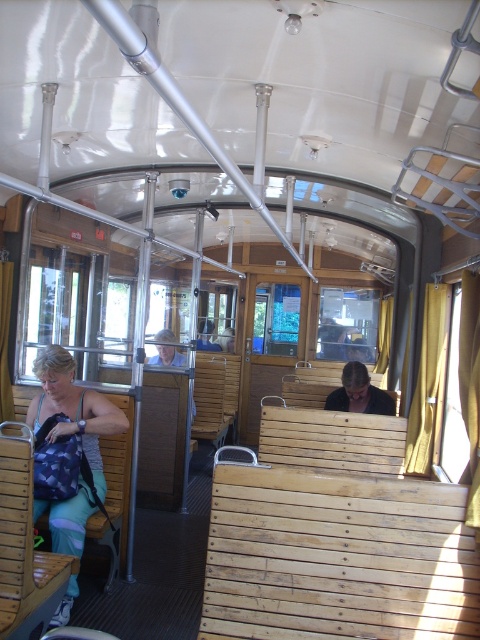
Based on the photo, which is above, matte blue backpack at left or dark brown leather jacket at center?

dark brown leather jacket at center is above.

This screenshot has height=640, width=480. What do you see at coordinates (69, 449) in the screenshot? I see `matte blue backpack at left` at bounding box center [69, 449].

Measure the distance between matte blue backpack at left and camera.

matte blue backpack at left and camera are 9.92 feet apart from each other.

Locate an element on the screen. matte blue backpack at left is located at coordinates (69, 449).